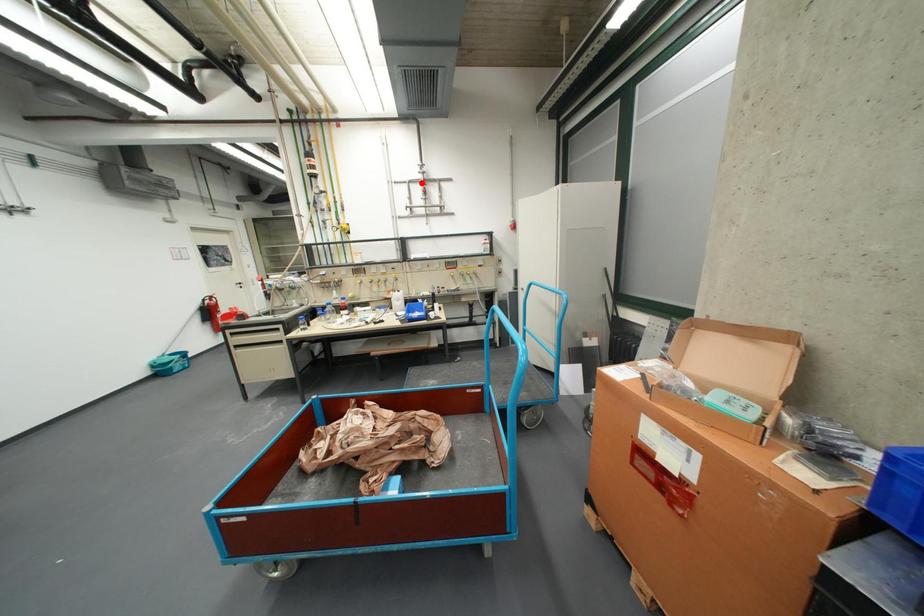
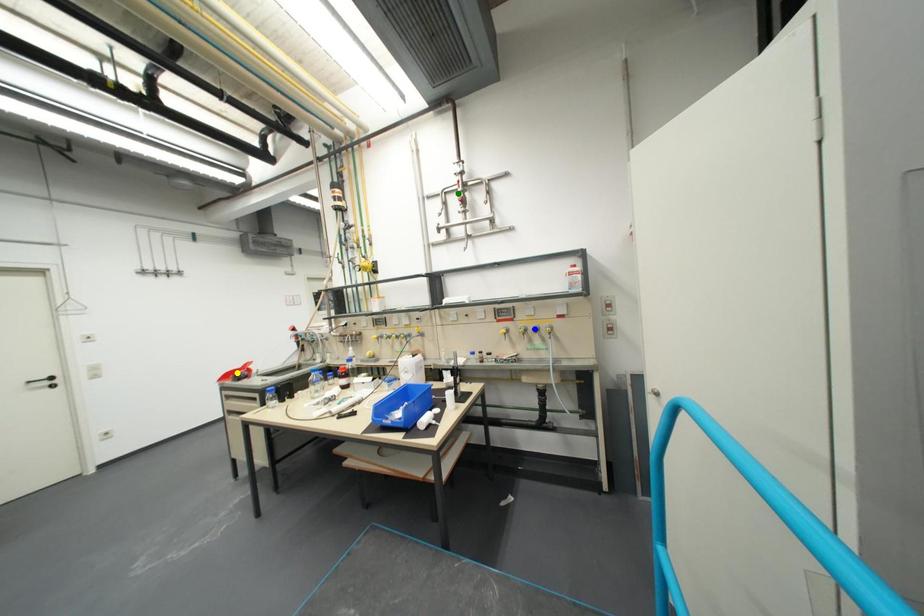
Question: I am providing you with two images of the same scene from different viewpoints. A red point is marked on the first image. You are given multiple points on the second image. Which point in image 2 represents the same 3d spot as the red point in image 1?

Choices:
 (A) blue point
 (B) green point
 (C) yellow point

Answer: (B)